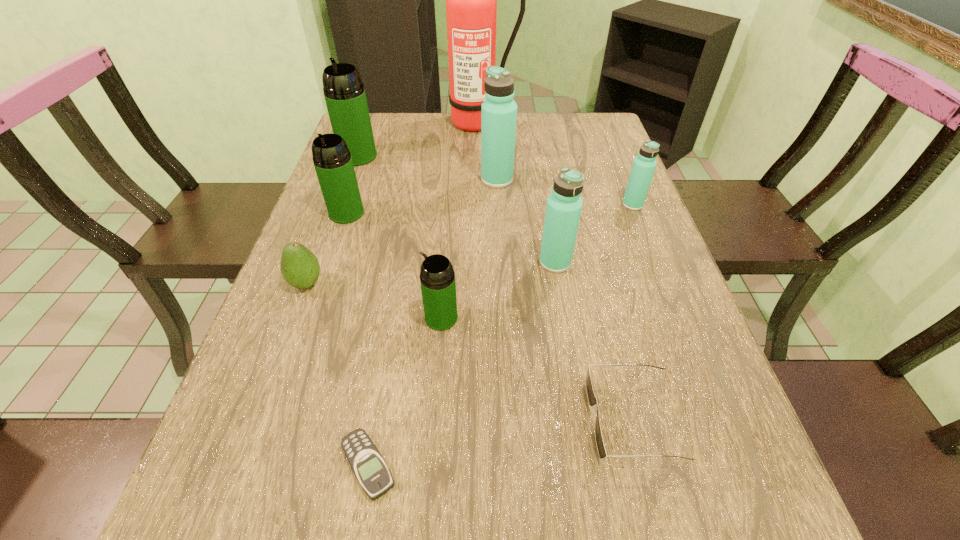
This screenshot has height=540, width=960. Find the location of `the tallest object`. the tallest object is located at coordinates (471, 0).

Identify the location of fire extinguisher. click(471, 0).

Where is `the farthest green thermos bottle`? Image resolution: width=960 pixels, height=540 pixels. the farthest green thermos bottle is located at coordinates pyautogui.click(x=344, y=92).

The height and width of the screenshot is (540, 960). Find the location of `the biggest green thermos bottle`. the biggest green thermos bottle is located at coordinates (344, 92).

At what (x,y) coordinates should I click in order to perform the action: click on the third thermos bottle from right to left. Please return your answer as a coordinate pair (x, y). This screenshot has height=540, width=960. Looking at the image, I should click on pyautogui.click(x=499, y=111).

This screenshot has width=960, height=540. Find the location of `the third farthest object`. the third farthest object is located at coordinates (499, 111).

At what (x,y) coordinates should I click in order to perform the action: click on the second nearest green thermos bottle. Please return your answer as a coordinate pair (x, y). Image resolution: width=960 pixels, height=540 pixels. Looking at the image, I should click on (332, 160).

The image size is (960, 540). I want to click on the fifth thermos bottle from left to right, so click(x=564, y=205).

This screenshot has height=540, width=960. In order to click on the nearest aqua thermos bottle in this screenshot , I will do `click(564, 205)`.

This screenshot has height=540, width=960. I want to click on the rightmost aqua thermos bottle, so click(644, 165).